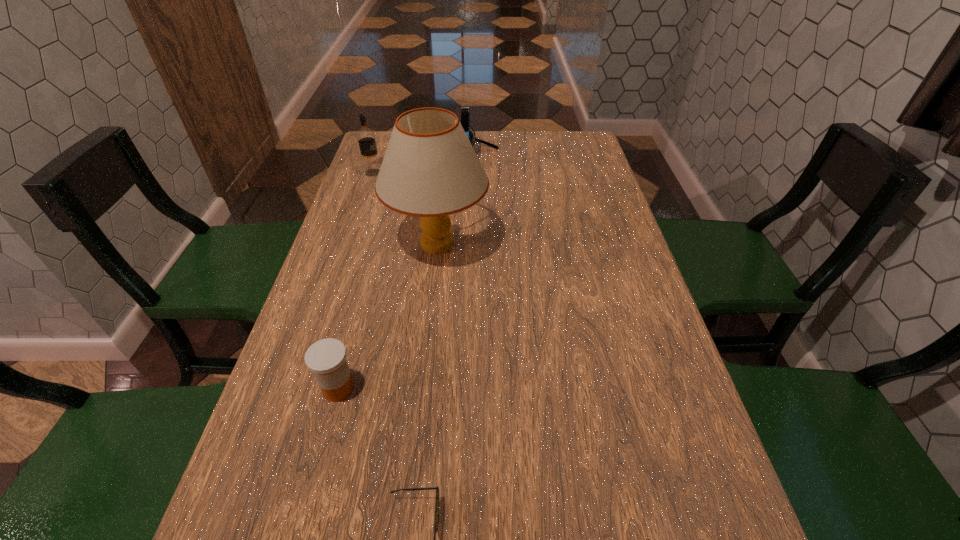
The width and height of the screenshot is (960, 540). Find the location of `the tallest object`. the tallest object is located at coordinates (430, 170).

Find the location of `the third farthest object`. the third farthest object is located at coordinates (430, 170).

You are a GUI agent. You are given a task and a screenshot of the screen. Output one action in this format:
    pyautogui.click(x=<x>, y=<y>)
    Task: Click on the vodka
    The height and width of the screenshot is (540, 960).
    Given the screenshot: What is the action you would take?
    pyautogui.click(x=366, y=137)

Locate an element on the screen. The height and width of the screenshot is (540, 960). headset is located at coordinates (465, 110).

Identify the location of the second nearest object. The height and width of the screenshot is (540, 960). (326, 358).

Find the location of a particular element. the fourth tallest object is located at coordinates (326, 358).

Identify the location of free spot located 0.330m on the front of the lampshade. (420, 406).

Image resolution: width=960 pixels, height=540 pixels. I want to click on vacant point located 0.340m on the label of the vodka, so click(x=491, y=173).

Image resolution: width=960 pixels, height=540 pixels. I want to click on vacant space located 0.270m with the microphone attached to the side of the headset, so click(x=582, y=159).

Where is `vacant area situated on the label of the medicine`? Image resolution: width=960 pixels, height=540 pixels. vacant area situated on the label of the medicine is located at coordinates (495, 389).